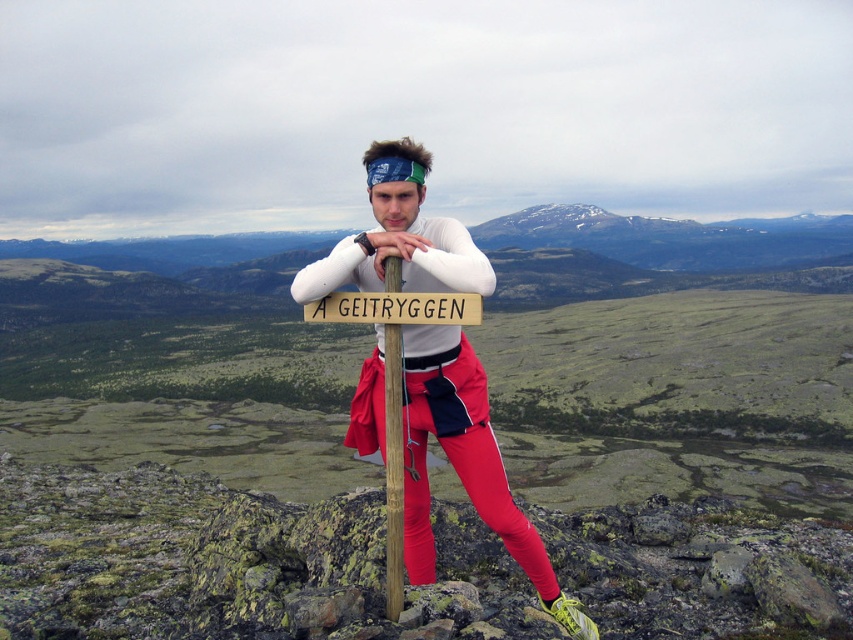
Is point (393, 449) positioned before point (476, 307)?

No, (393, 449) is further to viewer.

Based on the photo, can you confirm if wooden signpost at center is positioned to the left of wooden sign at center?

Incorrect, wooden signpost at center is not on the left side of wooden sign at center.

Is point (393, 444) positioned before point (341, 312)?

Yes, it is in front of point (341, 312).

Identify the location of wooden signpost at center. The width and height of the screenshot is (853, 640). (393, 468).

Is white matte shirt at center further to camera compared to wooden signpost at center?

No, it is not.

Does white matte shirt at center have a larger size compared to wooden signpost at center?

Indeed, white matte shirt at center has a larger size compared to wooden signpost at center.

Is point (469, 240) positioned behind point (392, 548)?

No, (469, 240) is closer to viewer.

Locate an element on the screen. white matte shirt at center is located at coordinates (463, 464).

Who is taller, white matte shirt at center or wooden sign at center?

Standing taller between the two is white matte shirt at center.

Who is higher up, white matte shirt at center or wooden sign at center?

wooden sign at center is higher up.

Is point (410, 228) positioned in front of point (480, 320)?

No.

You are a GUI agent. You are given a task and a screenshot of the screen. Output one action in this format:
    pyautogui.click(x=<x>, y=<y>)
    Task: Click on the white matte shirt at center
    This screenshot has width=853, height=640.
    Given the screenshot: What is the action you would take?
    pyautogui.click(x=463, y=464)